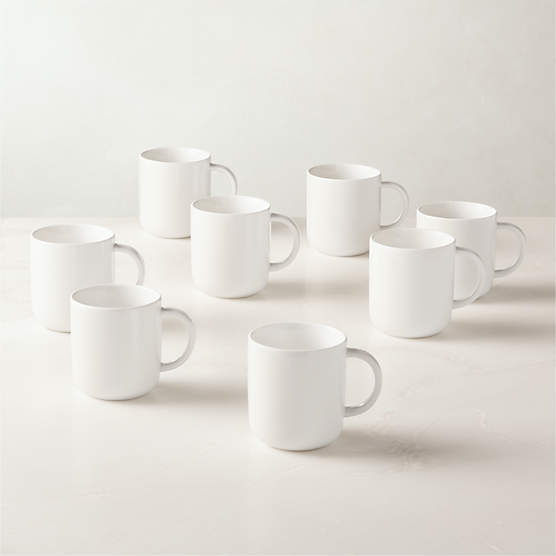
The height and width of the screenshot is (556, 556). I want to click on bottom of the teacup, so tap(116, 399), tap(289, 451), tap(416, 336), tap(219, 296), tap(57, 331), tap(178, 238), tap(332, 255), tap(483, 294).